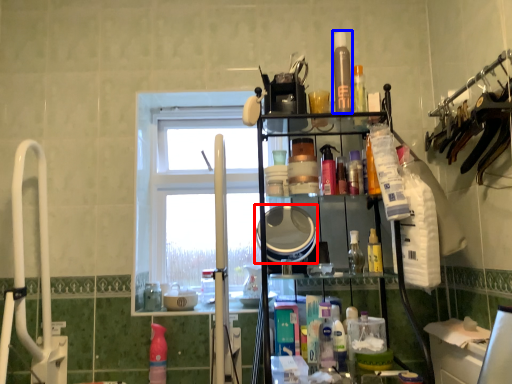
Question: Which point is closer to the camera, mirror (highlighted by a red box) or toiletry (highlighted by a blue box)?

Choices:
 (A) mirror
 (B) toiletry

Answer: (A)